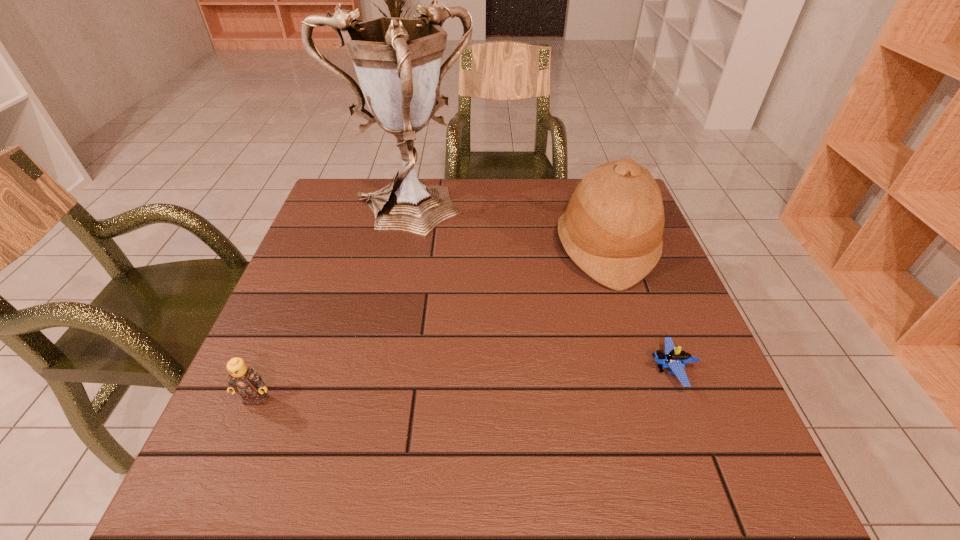
Locate an element on the screen. This screenshot has width=960, height=540. object present at the far left corner is located at coordinates (397, 60).

I want to click on object that is at the far right corner, so click(x=612, y=229).

You are a GUI agent. You are given a task and a screenshot of the screen. Output one action in this format:
    pyautogui.click(x=<x>, y=<y>)
    Task: Click on the vacant space at the far edge
    This screenshot has width=960, height=540.
    Given the screenshot: What is the action you would take?
    pyautogui.click(x=547, y=210)

Image resolution: width=960 pixels, height=540 pixels. Find the location of `free space at the near edge of the desktop`. free space at the near edge of the desktop is located at coordinates (459, 457).

I want to click on vacant space at the left edge, so click(x=320, y=239).

Find the location of a particular element. The width and height of the screenshot is (960, 540). vacant region at the right edge is located at coordinates (665, 335).

The height and width of the screenshot is (540, 960). I want to click on free point between the tallest object and the hat, so click(505, 232).

At what (x,y) coordinates should I click in order to perform the action: click on unoccupied position between the trophy cup and the second tallest object. Please return your answer as a coordinate pair (x, y). Looking at the image, I should click on (505, 232).

This screenshot has width=960, height=540. What are the coordinates of `vacant point located between the hat and the tallest object` in the screenshot? It's located at (505, 232).

Locate an element on the screen. The height and width of the screenshot is (540, 960). unoccupied area between the tallest object and the shorter Lego is located at coordinates (538, 293).